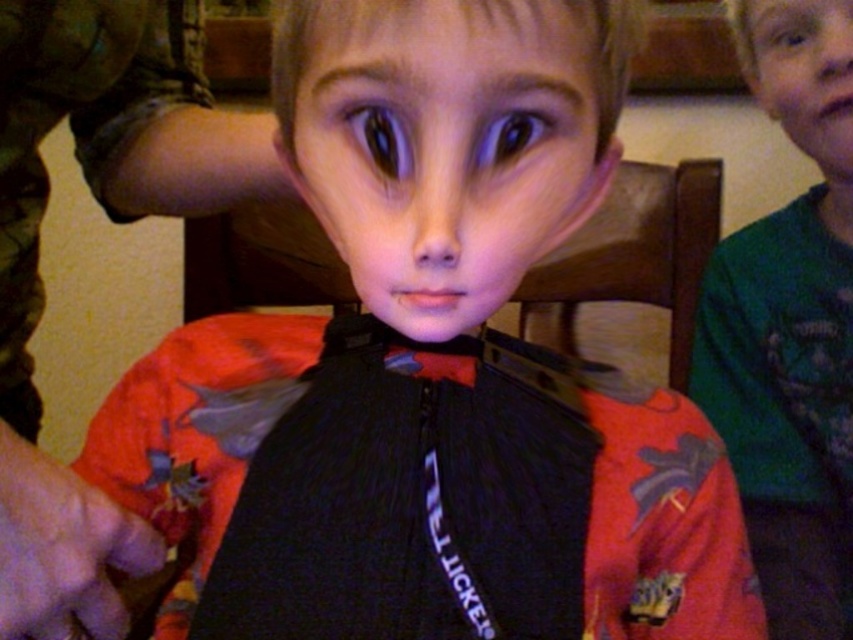
Question: Which object is the farthest from the smooth green shirt at upper right?

Choices:
 (A) green matte shirt at upper right
 (B) smooth skin face at center
 (C) matte black strap at center

Answer: (C)

Question: Which point is closer to the camera taking this photo?

Choices:
 (A) (308, 33)
 (B) (781, 548)
 (C) (258, 147)

Answer: (A)

Question: Which of these objects is positioned closest to the matte black strap at center?

Choices:
 (A) green matte shirt at upper right
 (B) smooth skin face at center

Answer: (B)

Question: Where is smooth skin face at center located in relation to green matte shirt at upper right in the image?

Choices:
 (A) left
 (B) right

Answer: (A)

Question: Can you confirm if smooth skin face at center is positioned to the right of green matte shirt at upper right?

Choices:
 (A) no
 (B) yes

Answer: (A)

Question: Is matte black strap at center to the right of smooth green shirt at upper right from the viewer's perspective?

Choices:
 (A) no
 (B) yes

Answer: (A)